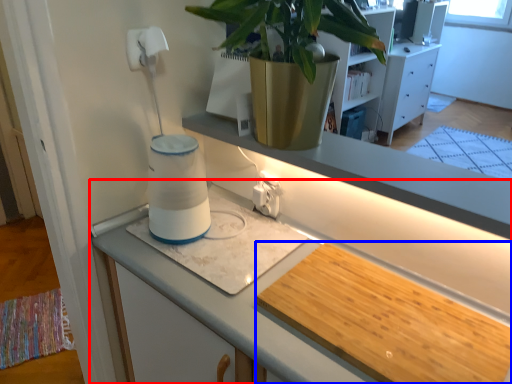
Question: Which of the following is the farthest to the observer, cabinetry (highlighted by a red box) or wide (highlighted by a blue box)?

Choices:
 (A) cabinetry
 (B) wide

Answer: (B)